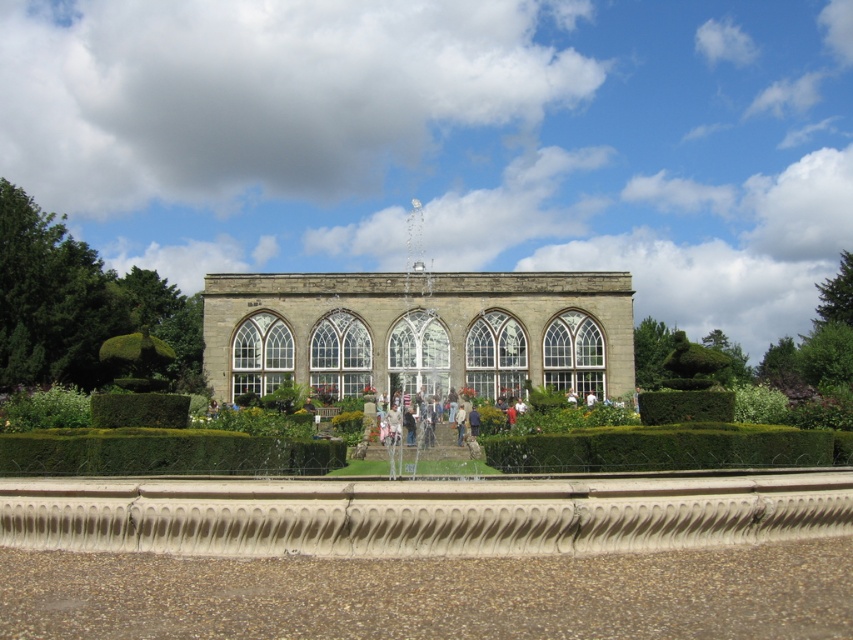
Who is more distant from viewer, [463,285] or [109,406]?

The point [463,285] is more distant.

Can you confirm if stone glass palace at center is bigger than green leafy hedge at lower left?

Indeed, stone glass palace at center has a larger size compared to green leafy hedge at lower left.

Locate an element on the screen. This screenshot has width=853, height=640. stone glass palace at center is located at coordinates (419, 332).

I want to click on stone glass palace at center, so click(419, 332).

Is stone glass palace at center wider than green leafy hedge at lower center?

Yes.

Can you confirm if stone glass palace at center is taller than green leafy hedge at lower center?

Yes.

Is point (583, 342) closer to viewer compared to point (128, 467)?

No, it is not.

Find the location of a particular element. The width and height of the screenshot is (853, 640). stone glass palace at center is located at coordinates (419, 332).

Between point (196, 449) and point (142, 410), which one is positioned in front?

Point (196, 449) is in front.

Between green leafy hedge at lower center and green leafy hedge at lower left, which one appears on the left side from the viewer's perspective?

green leafy hedge at lower left

Which is behind, point (323, 449) or point (173, 419)?

Point (173, 419)

Image resolution: width=853 pixels, height=640 pixels. What are the coordinates of `green leafy hedge at lower center` in the screenshot? It's located at (163, 452).